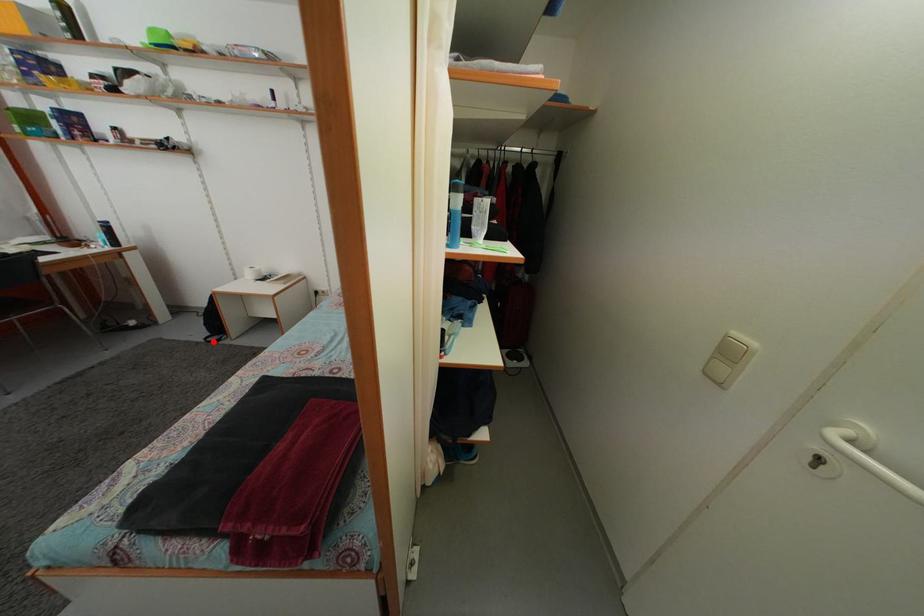
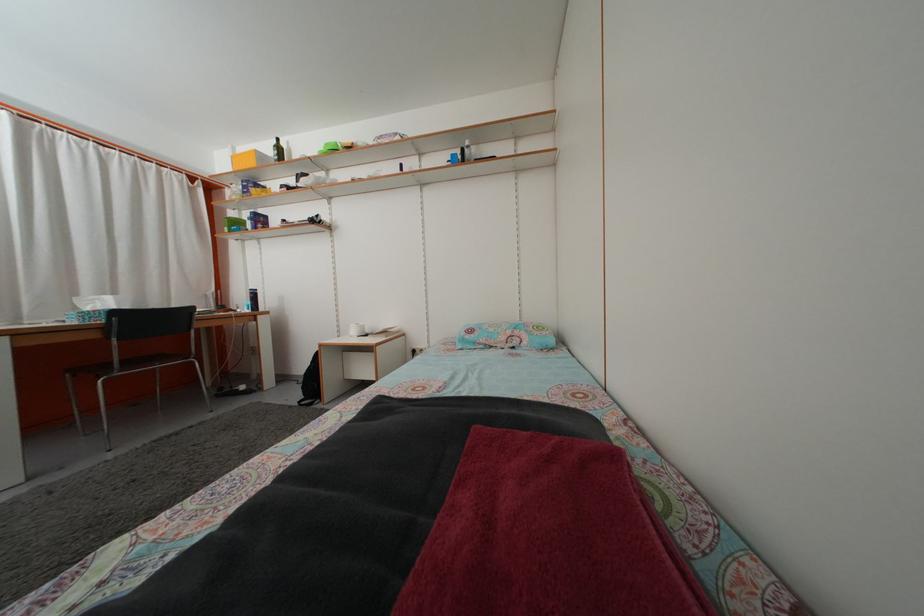
Question: I am providing you with two images of the same scene from different viewpoints. Image1 has a red point marked. In image2, the corresponding 3D location appears at what relative position? Reply with the corresponding letter.

Choices:
 (A) Closer
 (B) Farther

Answer: (A)